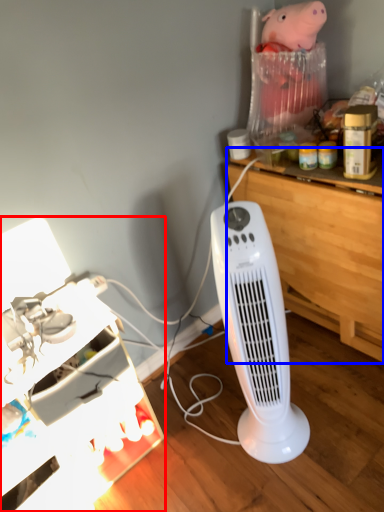
Question: Which point is further to the camera, furniture (highlighted by a red box) or computer desk (highlighted by a blue box)?

Choices:
 (A) furniture
 (B) computer desk

Answer: (B)